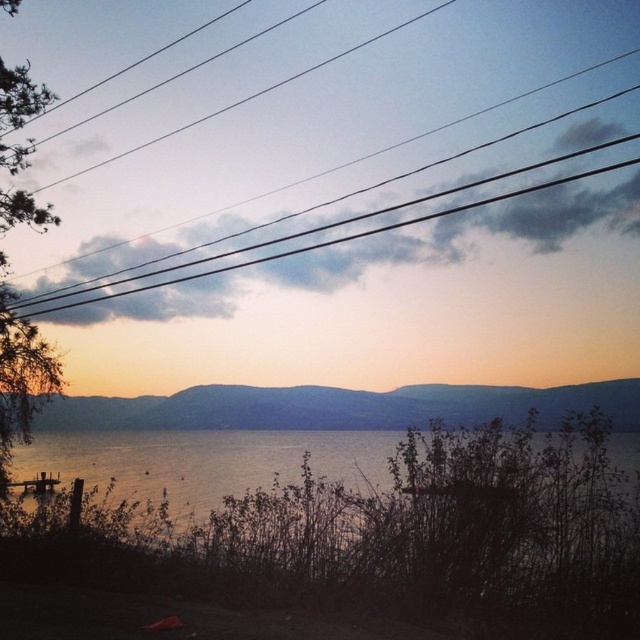
Can you confirm if silvery reflective water at lower center is bigger than black wire at upper center?

Incorrect, silvery reflective water at lower center is not larger than black wire at upper center.

Is silvery reflective water at lower center closer to the viewer compared to black wire at upper center?

Yes, silvery reflective water at lower center is closer to the viewer.

The image size is (640, 640). Describe the element at coordinates (204, 460) in the screenshot. I see `silvery reflective water at lower center` at that location.

Find the location of `silvery reflective water at lower center`. silvery reflective water at lower center is located at coordinates [204, 460].